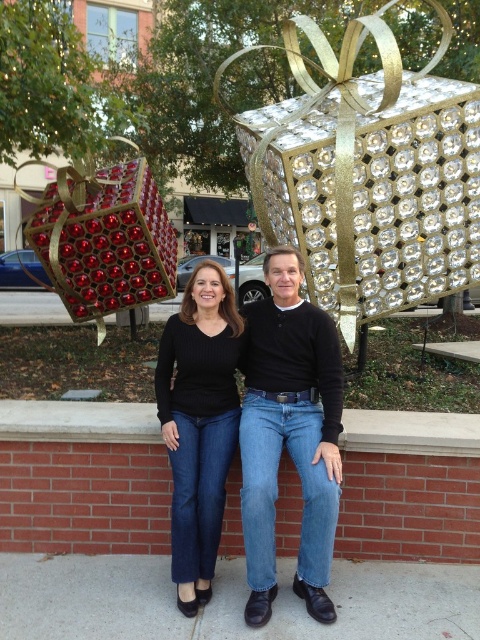
From the picture: Can you confirm if black matte jeans at center is positioned to the left of shiny red baubles at left?

No, black matte jeans at center is not to the left of shiny red baubles at left.

Who is higher up, black matte jeans at center or shiny red baubles at left?

Positioned higher is shiny red baubles at left.

Between point (300, 353) and point (143, 198), which one is positioned behind?

Positioned behind is point (143, 198).

Locate an element on the screen. The width and height of the screenshot is (480, 640). black matte jeans at center is located at coordinates (289, 433).

Which of these two, black knit sweater at center or shiny red baubles at left, stands taller?

With more height is shiny red baubles at left.

Is point (229, 452) positioned after point (111, 168)?

No.

Who is more distant from viewer, (196, 593) or (73, 218)?

Positioned behind is point (73, 218).

Where is `black knit sweater at center`? This screenshot has height=640, width=480. black knit sweater at center is located at coordinates (199, 424).

Between point (339, 392) and point (211, 280), which one is positioned behind?

Positioned behind is point (211, 280).

This screenshot has width=480, height=640. I want to click on black matte jeans at center, so click(x=289, y=433).